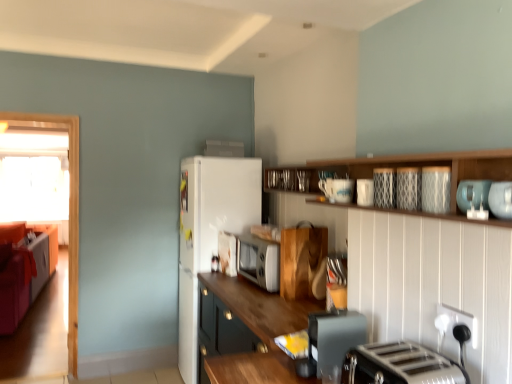
Where is `free point in front of white glossy microwave at center, which is the 3th appliance in bottom-to-top order`? free point in front of white glossy microwave at center, which is the 3th appliance in bottom-to-top order is located at coordinates (222, 277).